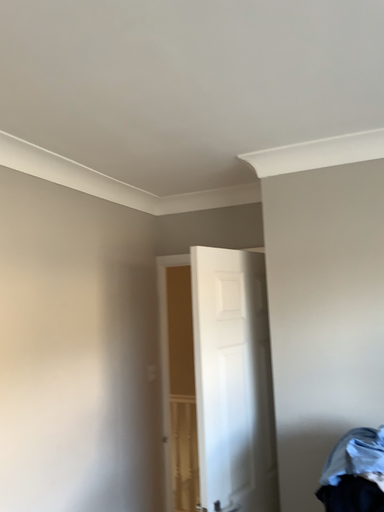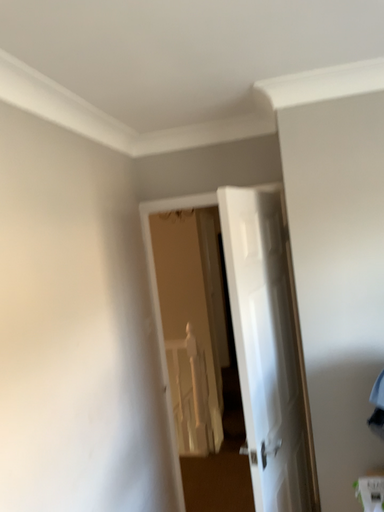
Question: Which way did the camera rotate in the video?

Choices:
 (A) rotated left
 (B) rotated right

Answer: (B)